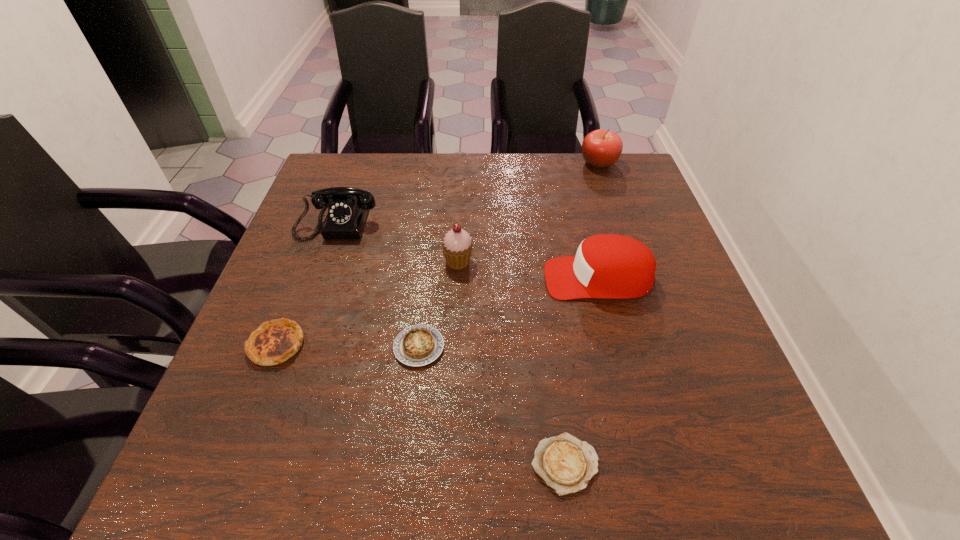
Locate an element on the screen. Image resolution: width=960 pixels, height=540 pixels. telephone located in the far edge section of the desktop is located at coordinates (347, 207).

Identify the location of object that is at the near edge. The image size is (960, 540). (566, 464).

Find the location of a particular element. The image size is (960, 540). telephone that is positioned at the left edge is located at coordinates (347, 207).

Find the location of a particular element. This screenshot has height=540, width=960. quiche that is at the left edge is located at coordinates (274, 342).

Locate an element on the screen. The image size is (960, 540). apple present at the right edge is located at coordinates (600, 148).

Identify the location of baseball cap that is at the right edge. This screenshot has height=540, width=960. (610, 266).

Identify the location of object that is at the far left corner. (347, 207).

Find the location of a particular element. object positioned at the far right corner is located at coordinates (600, 148).

Locate an element on the screen. This screenshot has width=960, height=540. free space at the far edge of the desktop is located at coordinates (525, 158).

Where is `vacant space at the near edge of the desktop`? vacant space at the near edge of the desktop is located at coordinates (657, 483).